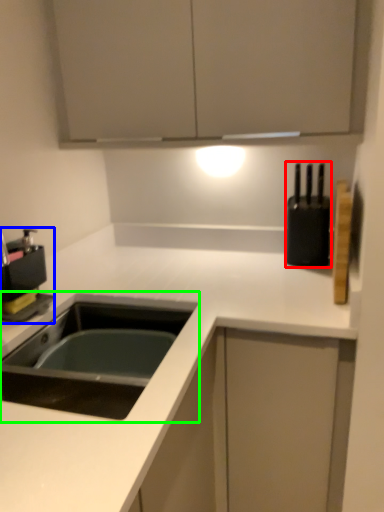
Question: Which object is positioned farthest from appliance (highlighted by a red box)? Select from coffee machine (highlighted by a blue box) and sink (highlighted by a green box).

Choices:
 (A) coffee machine
 (B) sink

Answer: (A)